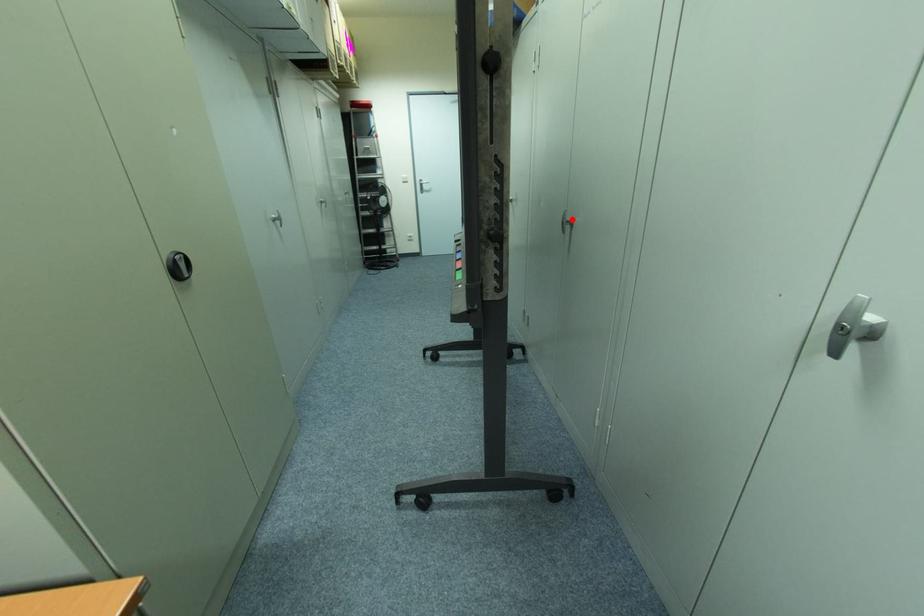
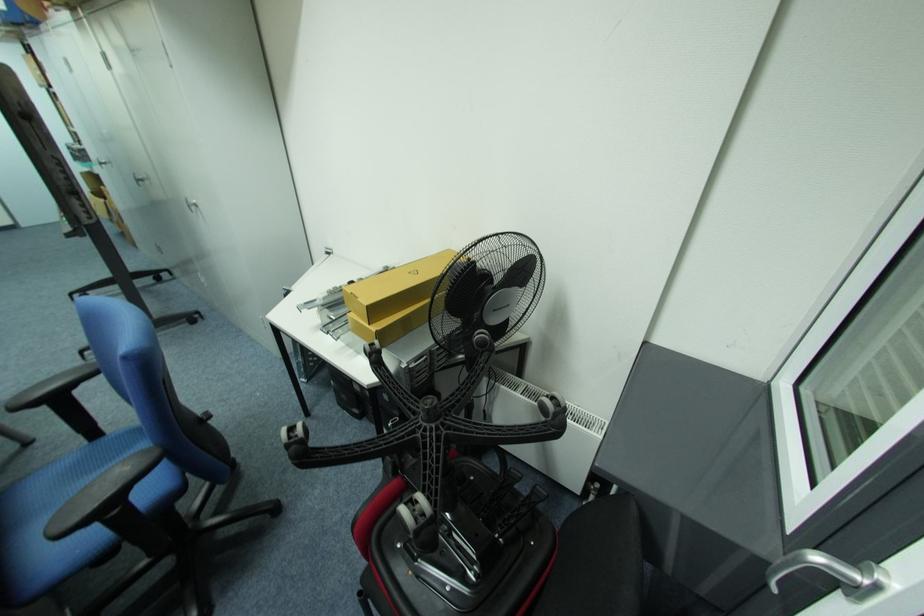
The point at the highlighted location is marked in the first image. Where is the corresponding point in the second image?

(141, 179)